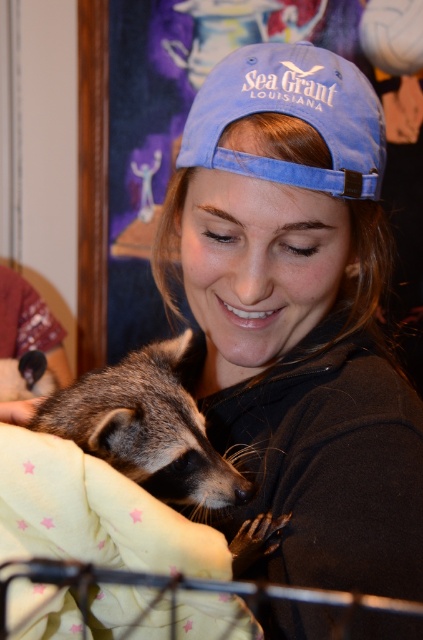
Which is more to the left, blue fabric baseball cap at upper center or fuzzy brown raccoon at lower left?

Positioned to the left is fuzzy brown raccoon at lower left.

Between blue fabric baseball cap at upper center and fuzzy brown raccoon at lower left, which one is positioned lower?

fuzzy brown raccoon at lower left is lower down.

Find the location of a particular element. The image size is (423, 640). blue fabric baseball cap at upper center is located at coordinates (291, 115).

Is yellow fleece blanket at lower left to the right of blue fabric baseball cap at upper center from the viewer's perspective?

In fact, yellow fleece blanket at lower left is to the left of blue fabric baseball cap at upper center.

Between yellow fleece blanket at lower left and blue fabric baseball cap at upper center, which one has less height?

blue fabric baseball cap at upper center is shorter.

Image resolution: width=423 pixels, height=640 pixels. What do you see at coordinates (93, 513) in the screenshot?
I see `yellow fleece blanket at lower left` at bounding box center [93, 513].

Locate an element on the screen. yellow fleece blanket at lower left is located at coordinates (93, 513).

Can you confirm if yellow fleece blanket at lower left is thinner than fuzzy brown raccoon at lower left?

Yes.

Does yellow fleece blanket at lower left have a greater height compared to fuzzy brown raccoon at lower left?

In fact, yellow fleece blanket at lower left may be shorter than fuzzy brown raccoon at lower left.

Image resolution: width=423 pixels, height=640 pixels. What do you see at coordinates (93, 513) in the screenshot? I see `yellow fleece blanket at lower left` at bounding box center [93, 513].

You are a GUI agent. You are given a task and a screenshot of the screen. Output one action in this format:
    pyautogui.click(x=<x>, y=<y>)
    Task: Click on the yellow fleece blanket at lower left
    This screenshot has height=640, width=423.
    Given the screenshot: What is the action you would take?
    pyautogui.click(x=93, y=513)